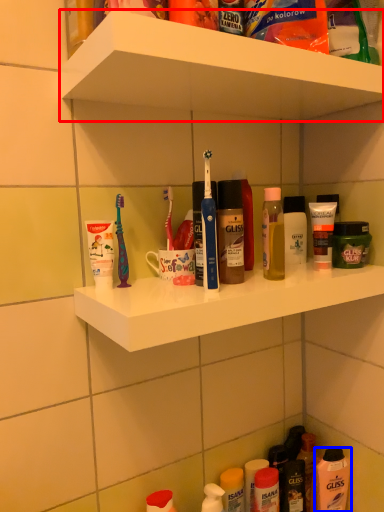
Question: Which object is closer to the camera taking this photo, supermarket shelf (highlighted by a red box) or mouthwash (highlighted by a blue box)?

Choices:
 (A) supermarket shelf
 (B) mouthwash

Answer: (A)